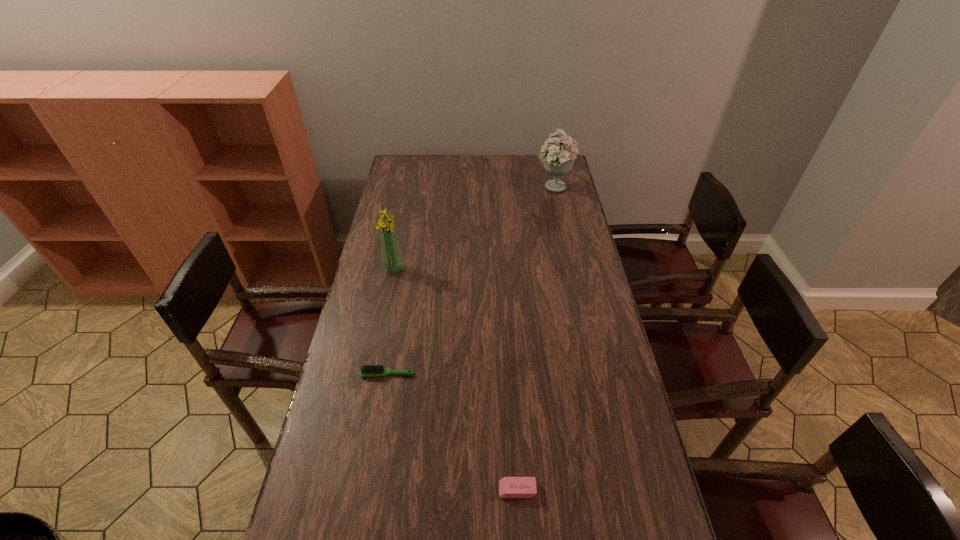
You are a GUI agent. You are given a task and a screenshot of the screen. Output one action in this format:
    pyautogui.click(x=<x>, y=<y>)
    Task: Click on the rightmost object
    
    Given the screenshot: What is the action you would take?
    pyautogui.click(x=558, y=160)

Locate an element on the screen. the farther bouquet is located at coordinates (558, 160).

The height and width of the screenshot is (540, 960). Identify the location of the left bouquet. (392, 258).

At what (x,y) coordinates should I click in order to perform the action: click on the nearer bouquet. Please return your answer as a coordinate pair (x, y). Image resolution: width=960 pixels, height=540 pixels. Looking at the image, I should click on (392, 258).

Find the location of `the third farthest object`. the third farthest object is located at coordinates (368, 370).

Image resolution: width=960 pixels, height=540 pixels. I want to click on the nearest object, so click(509, 487).

The image size is (960, 540). I want to click on eraser, so click(x=509, y=487).

In order to click on vacant space located 0.320m on the front of the farther bouquet in this screenshot , I will do `click(565, 243)`.

Identify the location of vacant space positioned on the front-facing side of the left bouquet. (425, 269).

Identify the location of vacant space situated 0.320m on the front of the hairbrush. This screenshot has height=540, width=960. (367, 487).